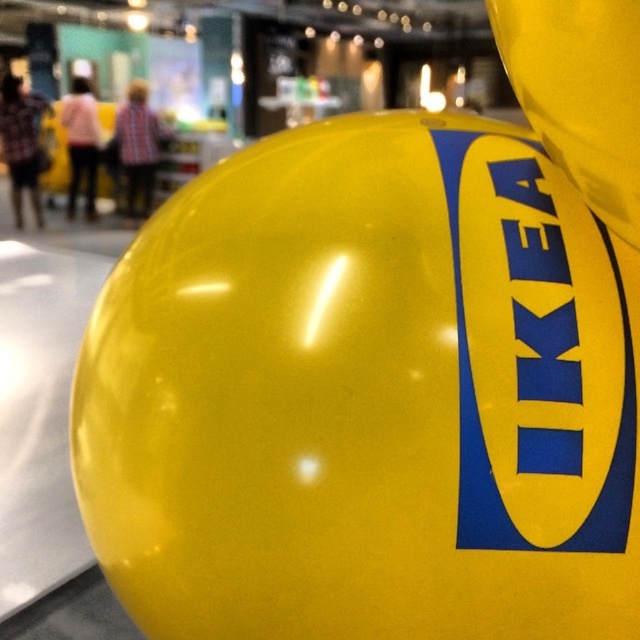
Question: Considering the real-world distances, which object is closest to the yellow glossy ikea logo at center?

Choices:
 (A) yellow rubber balloon at upper right
 (B) yellow rubber balloon at center

Answer: (B)

Question: Does yellow rubber balloon at center have a lesser width compared to yellow rubber balloon at upper right?

Choices:
 (A) yes
 (B) no

Answer: (B)

Question: Which object is farther from the camera taking this photo?

Choices:
 (A) yellow rubber balloon at upper right
 (B) yellow rubber balloon at center

Answer: (B)

Question: Is yellow rubber balloon at center to the right of yellow glossy ikea logo at center from the viewer's perspective?

Choices:
 (A) yes
 (B) no

Answer: (B)

Question: Among these points, which one is farthest from the camera?

Choices:
 (A) (225, 180)
 (B) (499, 35)

Answer: (A)

Question: Can you confirm if yellow glossy ikea logo at center is positioned above yellow rubber balloon at upper right?

Choices:
 (A) yes
 (B) no

Answer: (B)